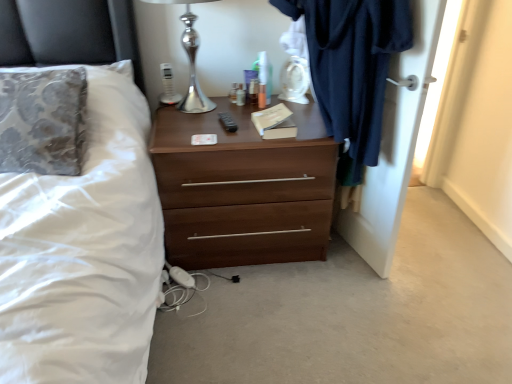
Where is `unoccupied area in front of dark blue fabric at right`? Image resolution: width=512 pixels, height=384 pixels. unoccupied area in front of dark blue fabric at right is located at coordinates (325, 327).